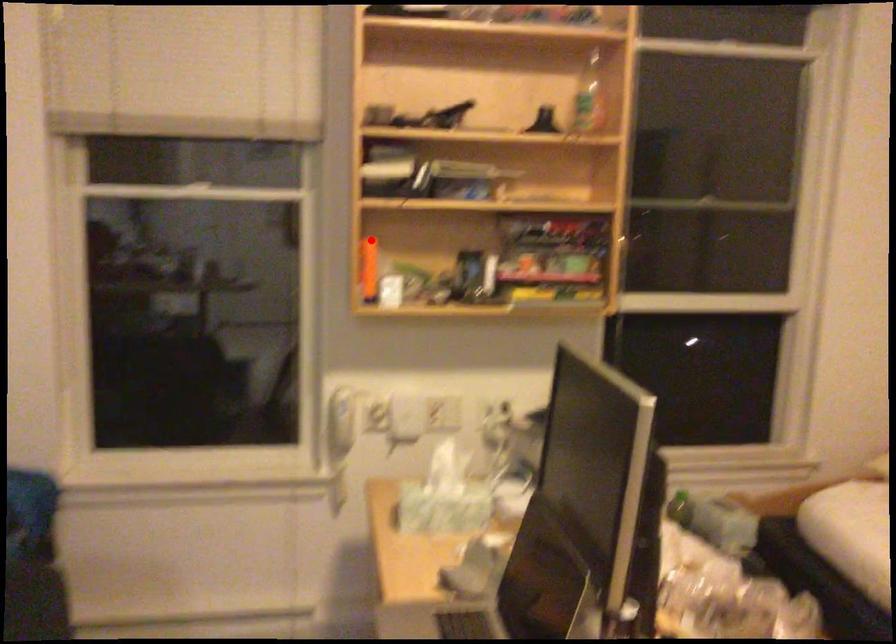
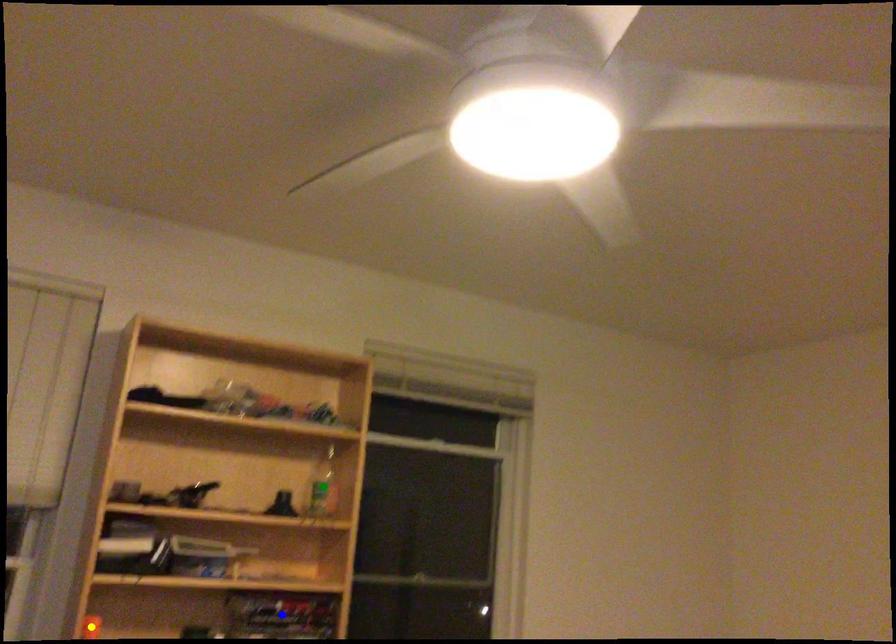
Question: I am providing you with two images of the same scene from different viewpoints. A red point is marked on the first image. You are given multiple points on the second image. Can you choose the point in image 2 that corresponds to the point in image 1?

Choices:
 (A) yellow point
 (B) green point
 (C) blue point

Answer: (A)